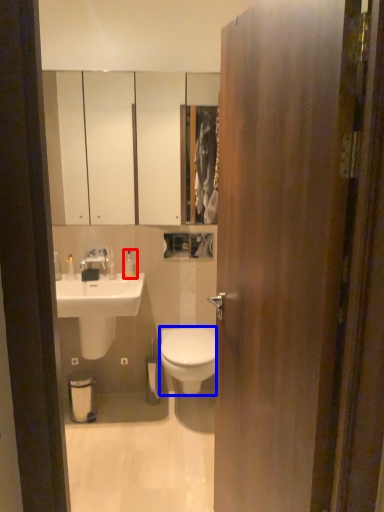
Question: Which of the following is the closest to the observer, toiletry (highlighted by a red box) or bidet (highlighted by a blue box)?

Choices:
 (A) toiletry
 (B) bidet

Answer: (B)